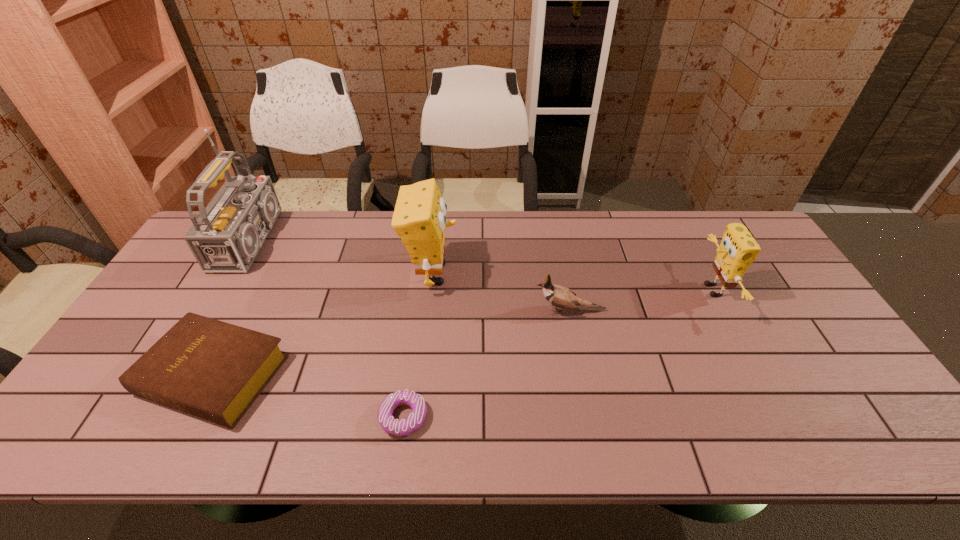
At what (x,y) coordinates should I click in order to perform the action: click on vacant area that lies between the right sponge and the bird. Please return your answer as a coordinate pair (x, y). This screenshot has height=540, width=960. Looking at the image, I should click on (640, 300).

Find the location of a particular element. unoccupied position between the left sponge and the fourth tallest object is located at coordinates click(x=501, y=292).

Identify which object is the fifth nearest to the left sponge. Please provide its 2D coordinates. Your answer should be formatted as a tuple, i.e. [(x, y)], where the tuple contains the x and y coordinates of a point satisfying the conditions above.

[(738, 249)]

Identify the location of the fourth closest object to the right sponge. Image resolution: width=960 pixels, height=540 pixels. (214, 370).

You are a GUI agent. You are given a task and a screenshot of the screen. Output one action in this format:
    pyautogui.click(x=<x>, y=<y>)
    Task: Click on the vacant space that satisfies the following two spatial constraints: 1. on the front-facing side of the radio receiver; 2. on the left side of the Bible
    This screenshot has height=540, width=960.
    Given the screenshot: What is the action you would take?
    pyautogui.click(x=180, y=375)

At what (x,y) coordinates should I click in order to perform the action: click on free spot that satisfies the following two spatial constraints: 1. on the face of the rightmost object; 2. on the front side of the doughnut. Please return your answer as a coordinate pair (x, y). Looking at the image, I should click on (779, 417).

This screenshot has width=960, height=540. Identify the location of vacant space that satisfies the following two spatial constraints: 1. on the front-facing side of the second shortest object; 2. on the right side of the radio receiver. (180, 375).